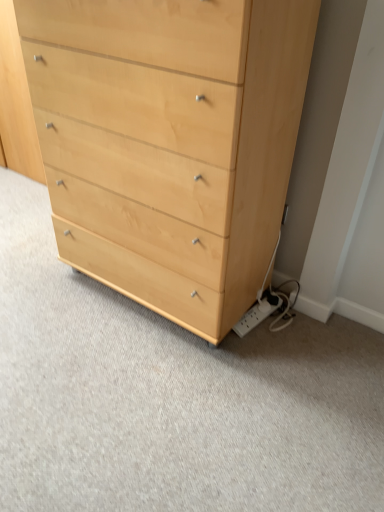
Find the location of a particular element. The height and width of the screenshot is (512, 384). free point in front of white plastic power strip at lower right is located at coordinates (261, 352).